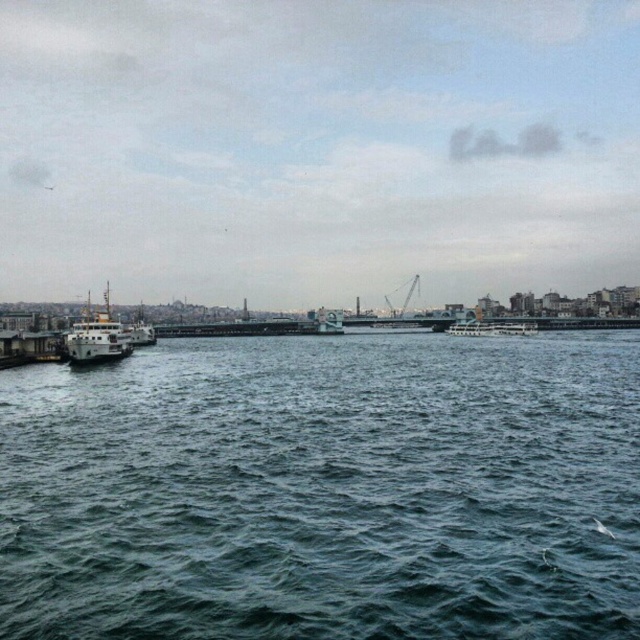
Question: Estimate the real-world distances between objects in this image. Which object is closer to the metallic gray crane at center?

Choices:
 (A) dark blue water at center
 (B) white matte boat at left

Answer: (B)

Question: Which object appears closest to the camera in this image?

Choices:
 (A) metallic gray crane at center
 (B) dark blue water at center

Answer: (B)

Question: Which point is farther to the camera?

Choices:
 (A) metallic gray crane at center
 (B) white matte boat at left

Answer: (A)

Question: Is white matte boat at left above metallic gray crane at center?

Choices:
 (A) no
 (B) yes

Answer: (A)

Question: Is dark blue water at center below metallic gray crane at center?

Choices:
 (A) no
 (B) yes

Answer: (B)

Question: From the image, what is the correct spatial relationship of white matte boat at left in relation to metallic gray crane at center?

Choices:
 (A) above
 (B) below

Answer: (B)